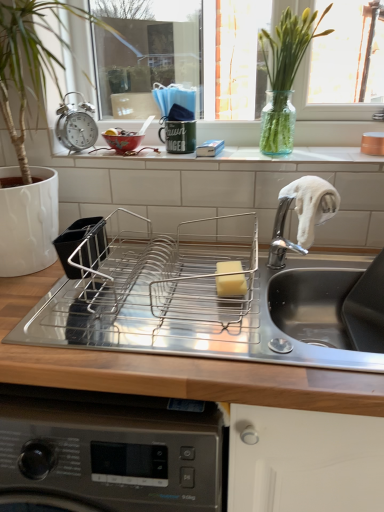
Locate an element on the screen. vacant region in front of stainless steel dish rack at center is located at coordinates (187, 361).